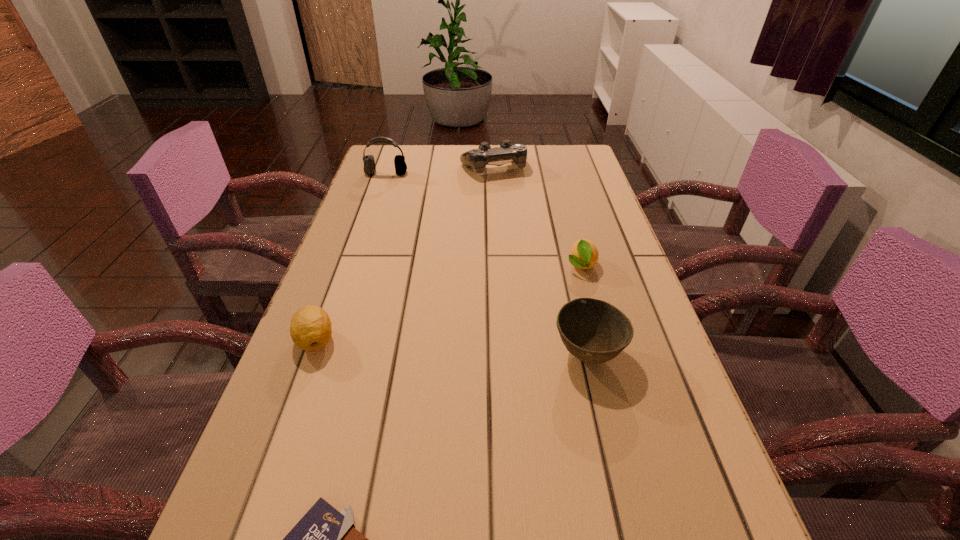
Locate an element on the screen. vacant space at the right edge is located at coordinates (645, 356).

I want to click on free location at the far right corner, so click(584, 167).

The image size is (960, 540). I want to click on vacant area between the tallest object and the control, so click(440, 171).

Find the location of a particular element. This screenshot has height=540, width=960. free space between the tallest object and the right lemon is located at coordinates (484, 219).

At what (x,y) coordinates should I click in order to perform the action: click on vacant area that lies between the bowl and the tallest object. Please return your answer as a coordinate pair (x, y). Looking at the image, I should click on pyautogui.click(x=487, y=264).

This screenshot has width=960, height=540. Find the location of `empty location between the bowl and the control`. empty location between the bowl and the control is located at coordinates (540, 261).

Locate an element on the screen. This screenshot has height=540, width=960. the second closest object to the chocolate bar is located at coordinates pyautogui.click(x=594, y=331).

Identify which object is the nearest to the fourth nearest object. Please provide its 2D coordinates. Your answer should be formatted as a tuple, i.e. [(x, y)], where the tuple contains the x and y coordinates of a point satisfying the conditions above.

[(594, 331)]

Identify the location of vacant space that satisfies the following two spatial constraints: 1. on the front side of the control; 2. on the right side of the bowl. (502, 354).

This screenshot has width=960, height=540. Find the location of `free space that satisfies the following two spatial constraints: 1. on the headband of the bowl; 2. on the right side of the headset`. free space that satisfies the following two spatial constraints: 1. on the headband of the bowl; 2. on the right side of the headset is located at coordinates coord(325,354).